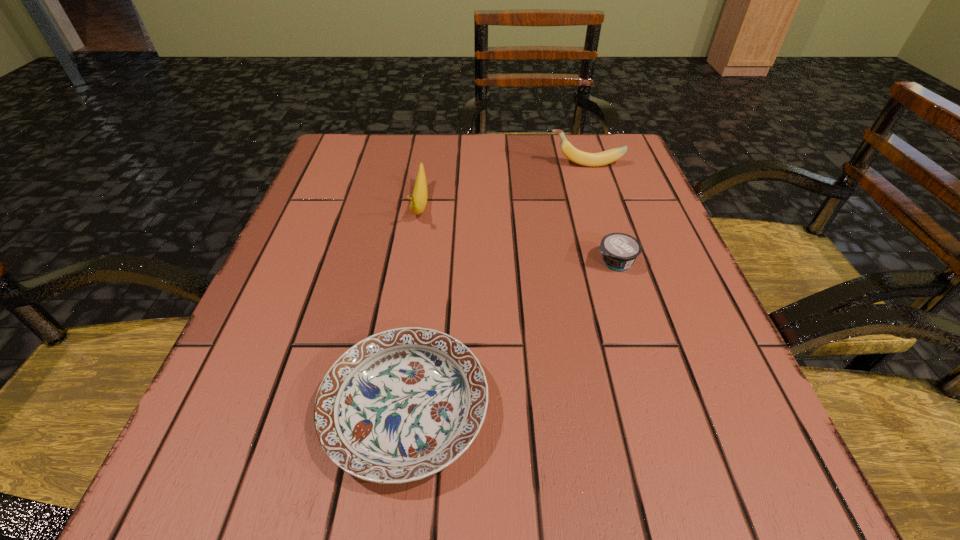
Where is `free space located 0.160m on the left of the yogurt`? This screenshot has width=960, height=540. free space located 0.160m on the left of the yogurt is located at coordinates (506, 262).

Locate an element on the screen. blank space located on the right of the plate is located at coordinates (641, 409).

Locate an element on the screen. Image resolution: width=960 pixels, height=540 pixels. object at the near edge is located at coordinates (400, 405).

Where is `object present at the left edge`? object present at the left edge is located at coordinates (400, 405).

Locate an element on the screen. The image size is (960, 540). banana located at the right edge is located at coordinates (577, 156).

Identify the location of yogurt present at the right edge. The height and width of the screenshot is (540, 960). click(x=619, y=251).

Where is `object located at the near left corner`? The width and height of the screenshot is (960, 540). object located at the near left corner is located at coordinates click(400, 405).

The width and height of the screenshot is (960, 540). What are the coordinates of `object that is at the far right corner` in the screenshot? It's located at (577, 156).

Where is `free space at the far edge of the desktop`? free space at the far edge of the desktop is located at coordinates (493, 180).

The image size is (960, 540). In order to click on free space at the left edge of the desktop in this screenshot , I will do `click(333, 216)`.